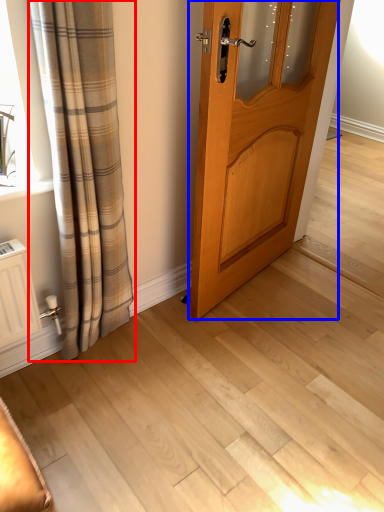
Question: Which object is further to the camera taking this photo, curtain (highlighted by a red box) or door (highlighted by a blue box)?

Choices:
 (A) curtain
 (B) door

Answer: (B)